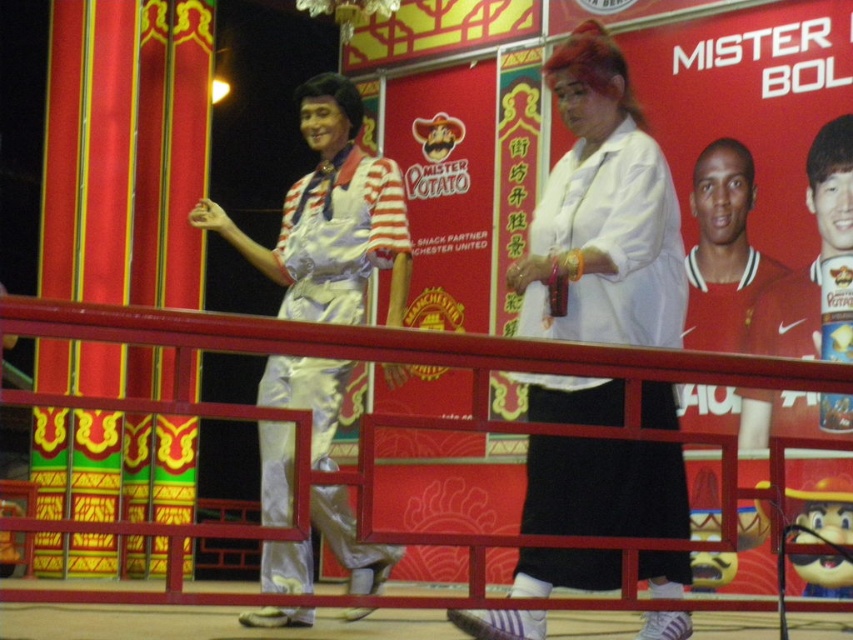
You are an event photographer positioned behind the red railing. You need to capture a photo of both the white matte shirt at center and the shiny silver jumpsuit at left. Which one will appear closer to you in the photo?

The white matte shirt at center will appear closer to you in the photo because it is positioned closer to the viewer than the shiny silver jumpsuit at left.

You are a photographer at the event. You want to take a photo of the shiny silver jumpsuit at left without the camera being visible in the frame. Given their distance apart, is this possible?

The shiny silver jumpsuit at left and camera are 24.41 meters apart. Since the camera is positioned far away from the jumpsuit, it is possible to take a photo without the camera appearing in the frame.

You are an event photographer positioned behind the metallic red railing at center. You want to capture a photo of the performer wearing the white matte shirt at center. Which direction should you move to get a better shot?

You should move to the left of the metallic red railing at center because the white matte shirt at center is positioned to the right of the railing. Moving left would allow you to align your camera with the performer.